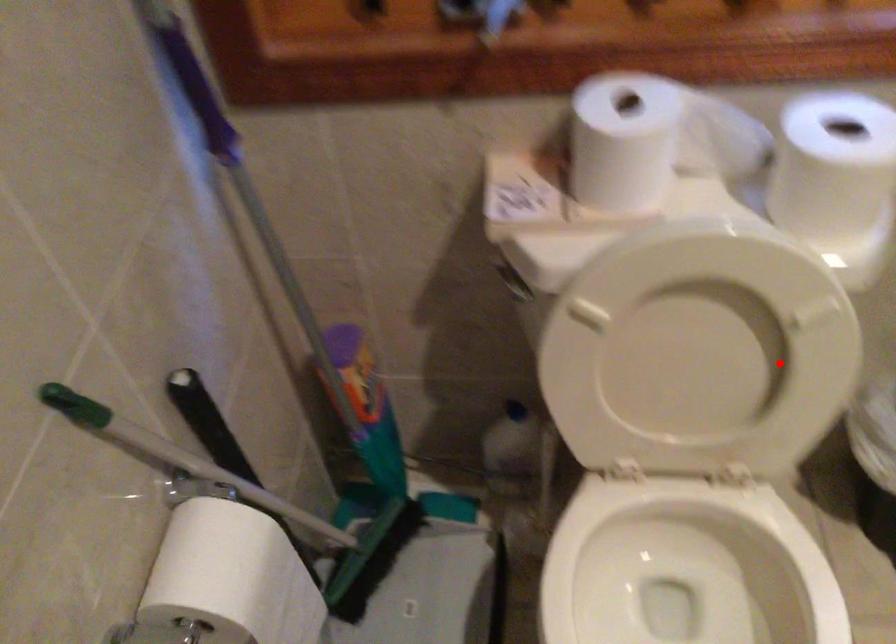
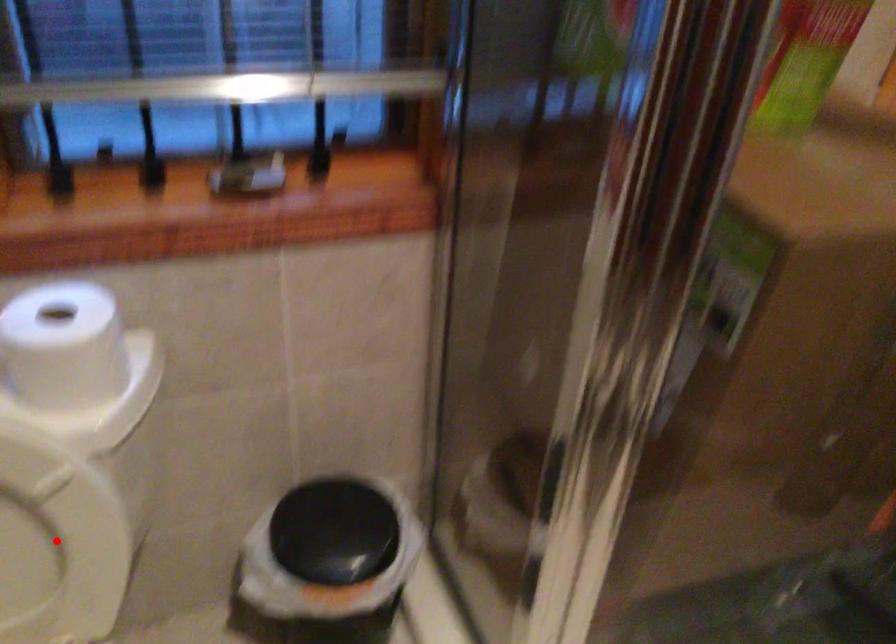
I am providing you with two images of the same scene from different viewpoints. A red point is marked on the first image and another point is marked on the second image. Are the points marked in image1 and image2 representing the same 3D position?

Yes